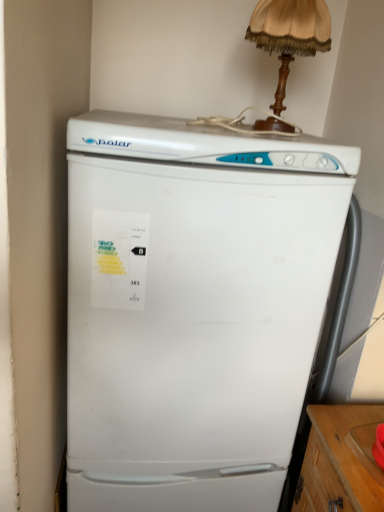
Describe the element at coordinates (193, 307) in the screenshot. This screenshot has height=512, width=384. I see `white matte refrigerator at center` at that location.

Locate an element on the screen. white matte refrigerator at center is located at coordinates (193, 307).

I want to click on wooden table lamp at upper center, so click(x=289, y=34).

What do you see at coordinates (289, 34) in the screenshot? I see `wooden table lamp at upper center` at bounding box center [289, 34].

Find the location of `white matte refrigerator at center`. white matte refrigerator at center is located at coordinates (193, 307).

Which is more to the left, wooden table lamp at upper center or white matte refrigerator at center?

white matte refrigerator at center.

Is wooden table lamp at upper center in front of white matte refrigerator at center?

No, it is not.

Between point (286, 74) and point (229, 307), which one is positioned behind?

The point (286, 74) is farther.

From the image's perspective, is wooden table lamp at upper center above or below white matte refrigerator at center?

Clearly, from the image's perspective, wooden table lamp at upper center is above white matte refrigerator at center.

From a real-world perspective, between wooden table lamp at upper center and white matte refrigerator at center, who is vertically lower?

white matte refrigerator at center is physically lower.

Does wooden table lamp at upper center have a greater width compared to white matte refrigerator at center?

Incorrect, the width of wooden table lamp at upper center does not surpass that of white matte refrigerator at center.

Who is taller, wooden table lamp at upper center or white matte refrigerator at center?

white matte refrigerator at center is taller.

In terms of size, does wooden table lamp at upper center appear bigger or smaller than white matte refrigerator at center?

Considering their sizes, wooden table lamp at upper center takes up less space than white matte refrigerator at center.

Is wooden table lamp at upper center positioned beyond the bounds of white matte refrigerator at center?

Absolutely, wooden table lamp at upper center is external to white matte refrigerator at center.

Is wooden table lamp at upper center next to white matte refrigerator at center and touching it?

They are not placed beside each other.

Could you tell me if wooden table lamp at upper center is facing white matte refrigerator at center?

No, wooden table lamp at upper center is not aimed at white matte refrigerator at center.

From the picture: How many degrees apart are the facing directions of wooden table lamp at upper center and white matte refrigerator at center?

There is a 0.000821-degree angle between the facing directions of wooden table lamp at upper center and white matte refrigerator at center.

Measure the distance between wooden table lamp at upper center and white matte refrigerator at center.

A distance of 22.18 inches exists between wooden table lamp at upper center and white matte refrigerator at center.

Where is `table lamp above the white matte refrigerator at center (from the image's perspective)`? The width and height of the screenshot is (384, 512). table lamp above the white matte refrigerator at center (from the image's perspective) is located at coordinates (289, 34).

Which object is positioned more to the left, white matte refrigerator at center or wooden table lamp at upper center?

Positioned to the left is white matte refrigerator at center.

In the image, is white matte refrigerator at center positioned in front of or behind wooden table lamp at upper center?

white matte refrigerator at center is in front of wooden table lamp at upper center.

Which is behind, point (83, 150) or point (262, 33)?

The point (262, 33) is more distant.

From the image's perspective, is white matte refrigerator at center on wooden table lamp at upper center?

No, from the image's perspective, white matte refrigerator at center is not above wooden table lamp at upper center.

From a real-world perspective, between white matte refrigerator at center and wooden table lamp at upper center, who is vertically lower?

From a 3D spatial view, white matte refrigerator at center is below.

Consider the image. Is white matte refrigerator at center wider than wooden table lamp at upper center?

Yes.

Is white matte refrigerator at center taller or shorter than wooden table lamp at upper center?

In the image, white matte refrigerator at center appears to be taller than wooden table lamp at upper center.

Considering the sizes of white matte refrigerator at center and wooden table lamp at upper center in the image, is white matte refrigerator at center bigger or smaller than wooden table lamp at upper center?

Clearly, white matte refrigerator at center is larger in size than wooden table lamp at upper center.

Is white matte refrigerator at center not inside wooden table lamp at upper center?

Yes, white matte refrigerator at center is located beyond the bounds of wooden table lamp at upper center.

Can you see white matte refrigerator at center touching wooden table lamp at upper center?

There is a gap between white matte refrigerator at center and wooden table lamp at upper center.

Is white matte refrigerator at center turned away from wooden table lamp at upper center?

That's not correct — white matte refrigerator at center is not looking away from wooden table lamp at upper center.

Can you tell me how much white matte refrigerator at center and wooden table lamp at upper center differ in facing direction?

white matte refrigerator at center and wooden table lamp at upper center are facing 0.000821 degrees away from each other.

At what (x,y) coordinates should I click in order to perform the action: click on table lamp on the right of white matte refrigerator at center. Please return your answer as a coordinate pair (x, y). Looking at the image, I should click on (289, 34).

Find the location of a particular element. This screenshot has height=512, width=384. refrigerator directly beneath the wooden table lamp at upper center (from a real-world perspective) is located at coordinates (193, 307).

I want to click on table lamp behind the white matte refrigerator at center, so click(289, 34).